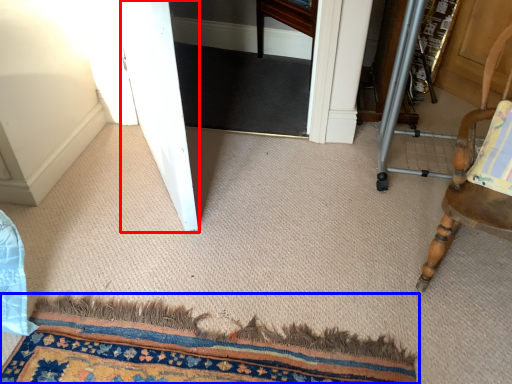
Question: Among these objects, which one is nearest to the camera, screen door (highlighted by a red box) or mat (highlighted by a blue box)?

Choices:
 (A) screen door
 (B) mat

Answer: (B)